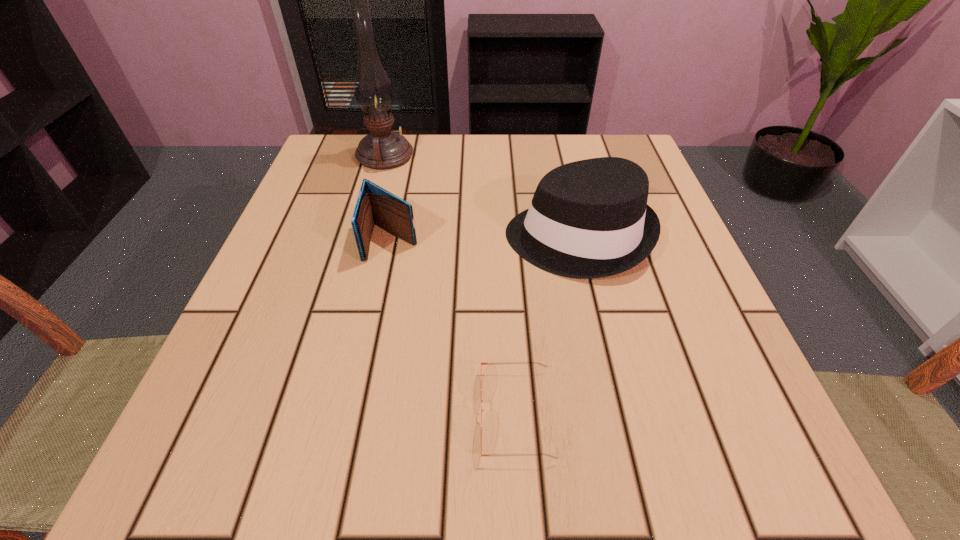
Where is `vacant area that lies between the wallet and the fedora`? This screenshot has width=960, height=540. vacant area that lies between the wallet and the fedora is located at coordinates (485, 239).

You are a GUI agent. You are given a task and a screenshot of the screen. Output one action in this format:
    pyautogui.click(x=<x>, y=<y>)
    Task: Click on the free space between the wallet and the nearest object
    The height and width of the screenshot is (540, 960).
    Given the screenshot: What is the action you would take?
    pyautogui.click(x=454, y=327)

You are a GUI agent. You are given a task and a screenshot of the screen. Output one action in this format:
    pyautogui.click(x=<x>, y=<y>)
    Task: Click on the object identified as the second closest to the oil lamp
    
    Given the screenshot: What is the action you would take?
    pyautogui.click(x=588, y=219)

Find the location of `object that is the closest one to the wallet`. object that is the closest one to the wallet is located at coordinates (588, 219).

Identify the location of free space in the image that satisfies the following two spatial constraints: 1. on the front side of the tallest object; 2. on the right side of the fedora. (362, 238).

Locate an element on the screen. The width and height of the screenshot is (960, 540). vacant space that satisfies the following two spatial constraints: 1. on the front side of the fedora; 2. on the face of the sunglasses is located at coordinates (619, 413).